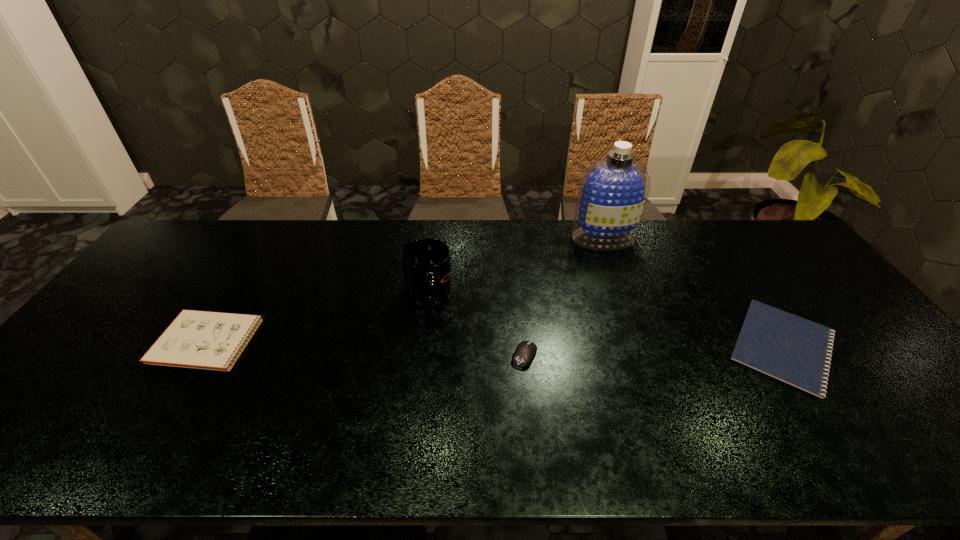
Where is `free area in between the third object from right to left and the shorter notepad`? This screenshot has width=960, height=540. free area in between the third object from right to left and the shorter notepad is located at coordinates (654, 350).

The image size is (960, 540). In order to click on blank region between the fourth object from right to left and the computer equipment in this screenshot , I will do `click(477, 326)`.

Image resolution: width=960 pixels, height=540 pixels. Identify the location of vacant area that lies between the taller notepad and the third object from left to right. (367, 349).

Identify the location of vacant space that's between the fourth shortest object and the rightmost object. The height and width of the screenshot is (540, 960). (606, 321).

The width and height of the screenshot is (960, 540). I want to click on empty space between the computer equipment and the shortest object, so click(x=654, y=350).

Find the location of a particular element. This screenshot has width=960, height=540. vacant space in between the computer equipment and the cleansing agent is located at coordinates (564, 296).

Locate an element on the screen. This screenshot has width=960, height=540. free space between the farthest object and the shortest object is located at coordinates (693, 292).

Identify the location of free point between the leftmost object and the computer equipment. The width and height of the screenshot is (960, 540). (367, 349).

Locate an element on the screen. object that is the third closest to the leftmost object is located at coordinates (612, 193).

Identify which object is the third nearest to the taller notepad. Please provide its 2D coordinates. Your answer should be formatted as a tuple, i.e. [(x, y)], where the tuple contains the x and y coordinates of a point satisfying the conditions above.

[(612, 193)]